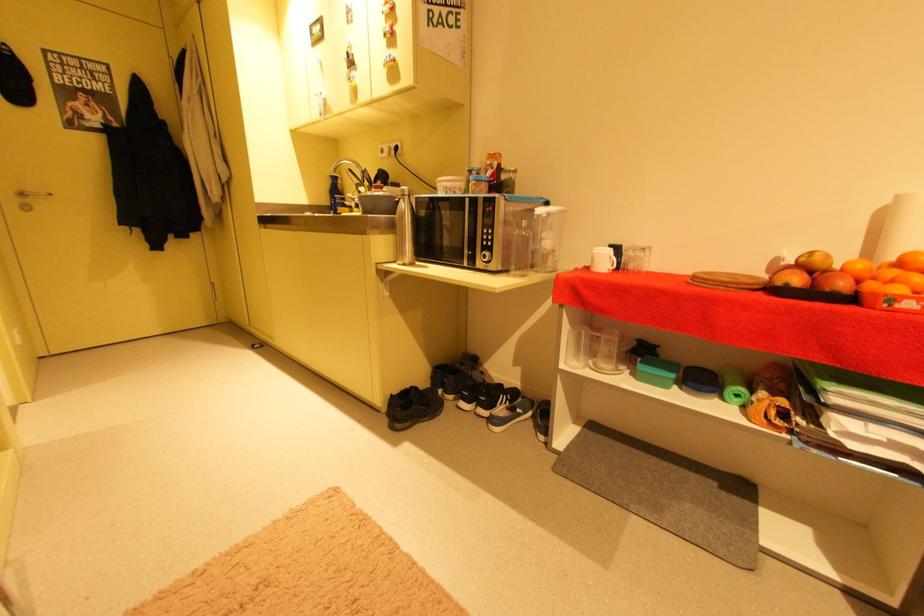
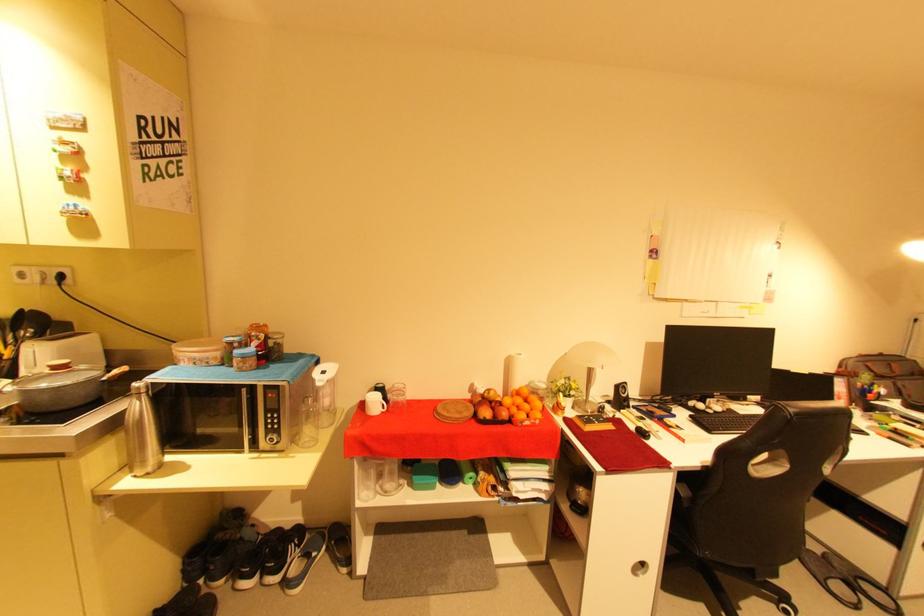
The point at (822, 286) is marked in the first image. Where is the corresponding point in the second image?

(503, 416)